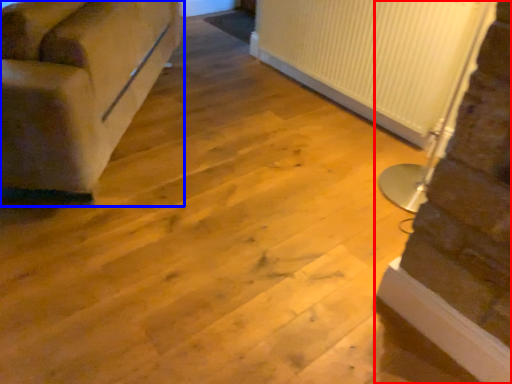
Question: Which object appears closest to the camera in this image, stairwell (highlighted by a red box) or studio couch (highlighted by a blue box)?

Choices:
 (A) stairwell
 (B) studio couch

Answer: (A)